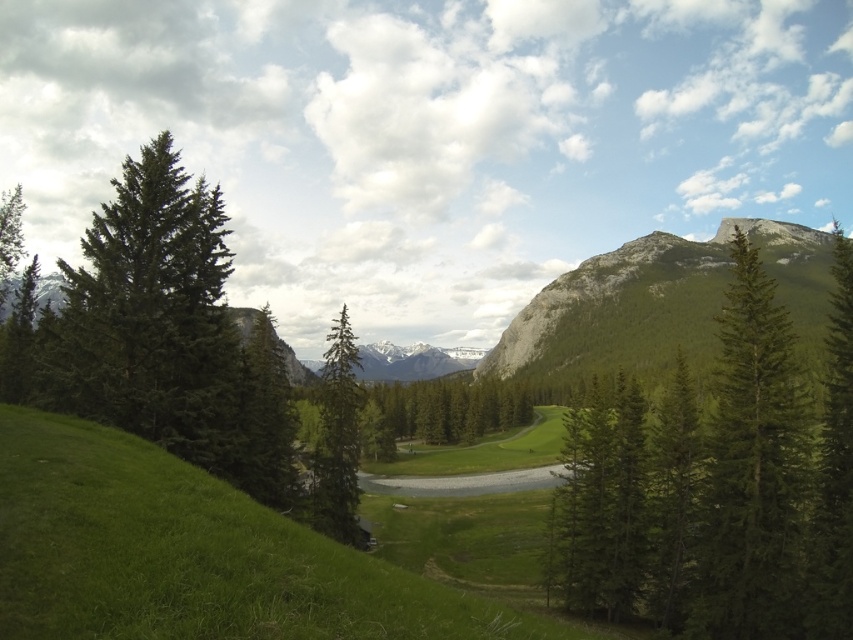
You are standing at the center of the valley and see both the green matte tree at right and the green matte tree at center. Which tree is positioned to the east of the other?

The green matte tree at right is to the east of the green matte tree at center.

You are an environmental scientist assessing the forest health. You observe the green matte tree at right and the green matte tree at center. Which tree would you prioritize for further study based on its size?

The green matte tree at right has a larger size compared to the green matte tree at center, so it should be prioritized for further study due to its prominence in the landscape.

You are a hiker standing at the base of the green matte tree at center. You want to reach the green matte tree at right. Which direction should you walk to get there?

The green matte tree at right is located above the green matte tree at center, so you should walk upwards to reach it.